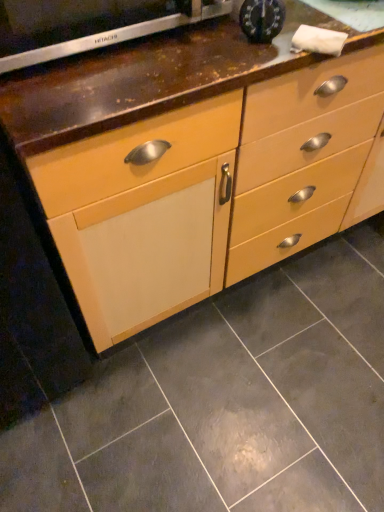
The image size is (384, 512). Describe the element at coordinates (197, 160) in the screenshot. I see `matte wood chest of drawers at center` at that location.

The width and height of the screenshot is (384, 512). Describe the element at coordinates (262, 19) in the screenshot. I see `metallic clock at upper center, acting as the second appliance starting from the left` at that location.

You are a GUI agent. You are given a task and a screenshot of the screen. Output one action in this format:
    pyautogui.click(x=<x>, y=<y>)
    Task: Click on the satin silver oven at upper left, acting as the 2th appliance starting from the right
    
    Given the screenshot: What is the action you would take?
    pyautogui.click(x=89, y=25)

Does satin silver oven at upper left, marked as the first appliance in a left-to-right arrangement, have a smaller size compared to matte wood chest of drawers at center?

Yes.

Does satin silver oven at upper left, acting as the 2th appliance starting from the right, lie behind matte wood chest of drawers at center?

No.

Does satin silver oven at upper left, acting as the 2th appliance starting from the right, have a greater height compared to matte wood chest of drawers at center?

In fact, satin silver oven at upper left, acting as the 2th appliance starting from the right, may be shorter than matte wood chest of drawers at center.

Considering the sizes of objects satin silver oven at upper left, marked as the first appliance in a left-to-right arrangement, and matte wood chest of drawers at center in the image provided, who is wider, satin silver oven at upper left, marked as the first appliance in a left-to-right arrangement, or matte wood chest of drawers at center?

With larger width is matte wood chest of drawers at center.

In the image, there is a satin silver oven at upper left, acting as the 2th appliance starting from the right. Where is `ceramic tile below it (from the image's perspective)`? ceramic tile below it (from the image's perspective) is located at coordinates (227, 403).

Looking at this image, can you tell me how much matte gray tile at center and satin silver oven at upper left, marked as the first appliance in a left-to-right arrangement, differ in facing direction?

matte gray tile at center and satin silver oven at upper left, marked as the first appliance in a left-to-right arrangement, are facing 89.8 degrees away from each other.

Considering the sizes of objects matte gray tile at center and satin silver oven at upper left, marked as the first appliance in a left-to-right arrangement, in the image provided, who is smaller, matte gray tile at center or satin silver oven at upper left, marked as the first appliance in a left-to-right arrangement,?

With smaller size is satin silver oven at upper left, marked as the first appliance in a left-to-right arrangement.

Is matte gray tile at center positioned before satin silver oven at upper left, marked as the first appliance in a left-to-right arrangement?

No, the depth of matte gray tile at center is greater than that of satin silver oven at upper left, marked as the first appliance in a left-to-right arrangement.

Would you say metallic clock at upper center, acting as the second appliance starting from the left, is inside or outside matte wood chest of drawers at center?

metallic clock at upper center, acting as the second appliance starting from the left, is not inside matte wood chest of drawers at center, it's outside.

From the image's perspective, between metallic clock at upper center, acting as the second appliance starting from the left, and matte wood chest of drawers at center, who is located below?

matte wood chest of drawers at center appears lower in the image.

Is metallic clock at upper center, acting as the second appliance starting from the left, to the right of matte wood chest of drawers at center from the viewer's perspective?

No, metallic clock at upper center, acting as the second appliance starting from the left, is not to the right of matte wood chest of drawers at center.

In terms of width, does metallic clock at upper center, acting as the second appliance starting from the left, look wider or thinner when compared to matte wood chest of drawers at center?

In the image, metallic clock at upper center, acting as the second appliance starting from the left, appears to be more narrow than matte wood chest of drawers at center.

This screenshot has width=384, height=512. What are the coordinates of `appliance on the right of satin silver oven at upper left, marked as the first appliance in a left-to-right arrangement` in the screenshot? It's located at (262, 19).

Is satin silver oven at upper left, marked as the first appliance in a left-to-right arrangement, situated inside metallic clock at upper center, which ranks as the 1th appliance in right-to-left order, or outside?

satin silver oven at upper left, marked as the first appliance in a left-to-right arrangement, is not enclosed by metallic clock at upper center, which ranks as the 1th appliance in right-to-left order.

Between satin silver oven at upper left, acting as the 2th appliance starting from the right, and metallic clock at upper center, acting as the second appliance starting from the left, which one is positioned behind?

metallic clock at upper center, acting as the second appliance starting from the left.

Are satin silver oven at upper left, marked as the first appliance in a left-to-right arrangement, and metallic clock at upper center, which ranks as the 1th appliance in right-to-left order, located far from each other?

No.

What are the coordinates of `ceramic tile that appears behind the matte wood chest of drawers at center` in the screenshot? It's located at (227, 403).

Which is less distant, (213, 387) or (96, 207)?

Point (213, 387) appears to be farther away from the viewer than point (96, 207).

Would you say matte wood chest of drawers at center is part of matte gray tile at center's contents?

Definitely not — matte wood chest of drawers at center is not inside matte gray tile at center.

Are matte gray tile at center and matte wood chest of drawers at center beside each other?

matte gray tile at center is not next to matte wood chest of drawers at center, and they're not touching.

From the picture: Between satin silver oven at upper left, marked as the first appliance in a left-to-right arrangement, and matte gray tile at center, which one has smaller width?

Thinner between the two is satin silver oven at upper left, marked as the first appliance in a left-to-right arrangement.

From a real-world perspective, between satin silver oven at upper left, marked as the first appliance in a left-to-right arrangement, and matte gray tile at center, who is vertically lower?

From a 3D spatial view, matte gray tile at center is below.

Is matte gray tile at center at the back of satin silver oven at upper left, marked as the first appliance in a left-to-right arrangement?

satin silver oven at upper left, marked as the first appliance in a left-to-right arrangement, is not turned away from matte gray tile at center.

Does satin silver oven at upper left, acting as the 2th appliance starting from the right, have a smaller size compared to matte gray tile at center?

Indeed, satin silver oven at upper left, acting as the 2th appliance starting from the right, has a smaller size compared to matte gray tile at center.

Is matte wood chest of drawers at center wider or thinner than satin silver oven at upper left, acting as the 2th appliance starting from the right?

In the image, matte wood chest of drawers at center appears to be wider than satin silver oven at upper left, acting as the 2th appliance starting from the right.

Considering the positions of objects matte wood chest of drawers at center and satin silver oven at upper left, marked as the first appliance in a left-to-right arrangement, in the image provided, who is more to the left, matte wood chest of drawers at center or satin silver oven at upper left, marked as the first appliance in a left-to-right arrangement,?

Positioned to the left is satin silver oven at upper left, marked as the first appliance in a left-to-right arrangement.

At what (x,y) coordinates should I click in order to perform the action: click on appliance in front of the matte wood chest of drawers at center. Please return your answer as a coordinate pair (x, y). Looking at the image, I should click on (89, 25).

From the image's perspective, starting from the matte gray tile at center, which appliance is the 2nd one above? Please provide its 2D coordinates.

[(89, 25)]

Estimate the real-world distances between objects in this image. Which object is further from satin silver oven at upper left, marked as the first appliance in a left-to-right arrangement, matte gray tile at center or matte wood chest of drawers at center?

matte gray tile at center lies further to satin silver oven at upper left, marked as the first appliance in a left-to-right arrangement, than the other object.

Based on their spatial positions, is matte gray tile at center or satin silver oven at upper left, marked as the first appliance in a left-to-right arrangement, further from metallic clock at upper center, which ranks as the 1th appliance in right-to-left order?

Based on the image, matte gray tile at center appears to be further to metallic clock at upper center, which ranks as the 1th appliance in right-to-left order.

Estimate the real-world distances between objects in this image. Which object is further from matte gray tile at center, satin silver oven at upper left, marked as the first appliance in a left-to-right arrangement, or matte wood chest of drawers at center?

satin silver oven at upper left, marked as the first appliance in a left-to-right arrangement.

Which object lies further to the anchor point matte gray tile at center, metallic clock at upper center, acting as the second appliance starting from the left, or satin silver oven at upper left, acting as the 2th appliance starting from the right?

metallic clock at upper center, acting as the second appliance starting from the left, is positioned further to the anchor matte gray tile at center.

Estimate the real-world distances between objects in this image. Which object is closer to metallic clock at upper center, acting as the second appliance starting from the left, matte wood chest of drawers at center or satin silver oven at upper left, marked as the first appliance in a left-to-right arrangement?

Based on the image, satin silver oven at upper left, marked as the first appliance in a left-to-right arrangement, appears to be nearer to metallic clock at upper center, acting as the second appliance starting from the left.

Estimate the real-world distances between objects in this image. Which object is further from matte wood chest of drawers at center, metallic clock at upper center, which ranks as the 1th appliance in right-to-left order, or matte gray tile at center?

matte gray tile at center is positioned further to the anchor matte wood chest of drawers at center.

Estimate the real-world distances between objects in this image. Which object is further from matte wood chest of drawers at center, matte gray tile at center or metallic clock at upper center, which ranks as the 1th appliance in right-to-left order?

matte gray tile at center.

Based on their spatial positions, is metallic clock at upper center, which ranks as the 1th appliance in right-to-left order, or matte wood chest of drawers at center further from satin silver oven at upper left, marked as the first appliance in a left-to-right arrangement?

Among the two, matte wood chest of drawers at center is located further to satin silver oven at upper left, marked as the first appliance in a left-to-right arrangement.

Where is `appliance that lies between satin silver oven at upper left, acting as the 2th appliance starting from the right, and matte gray tile at center from top to bottom`? This screenshot has width=384, height=512. appliance that lies between satin silver oven at upper left, acting as the 2th appliance starting from the right, and matte gray tile at center from top to bottom is located at coordinates (262, 19).

Identify the location of chest of drawers between satin silver oven at upper left, marked as the first appliance in a left-to-right arrangement, and matte gray tile at center, in the vertical direction. This screenshot has height=512, width=384. (197, 160).

Identify the location of the chest of drawers that lies between metallic clock at upper center, acting as the second appliance starting from the left, and matte gray tile at center from top to bottom. The image size is (384, 512). (197, 160).

Identify the location of appliance located between satin silver oven at upper left, marked as the first appliance in a left-to-right arrangement, and matte wood chest of drawers at center in the left-right direction. The height and width of the screenshot is (512, 384). (262, 19).